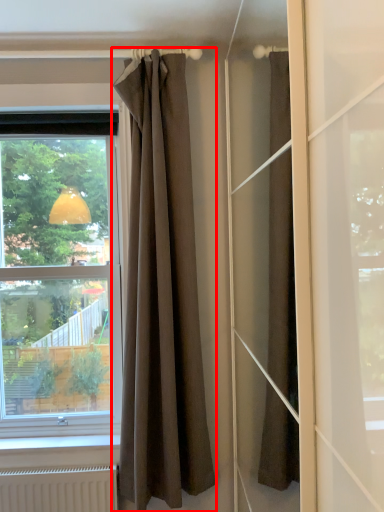
Question: In this image, where is curtain (annotated by the red box) located relative to window?

Choices:
 (A) left
 (B) right

Answer: (B)